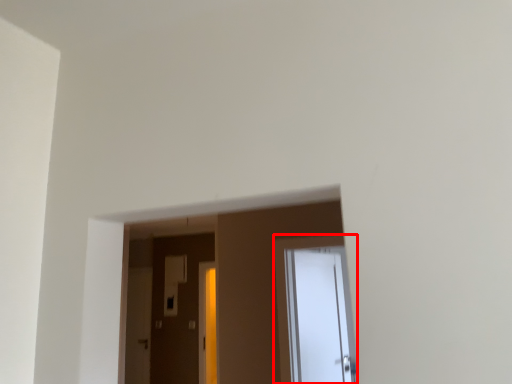
Question: From the image's perspective, what is the correct spatial positioning of door (annotated by the red box) in reference to screen door?

Choices:
 (A) above
 (B) below

Answer: (A)